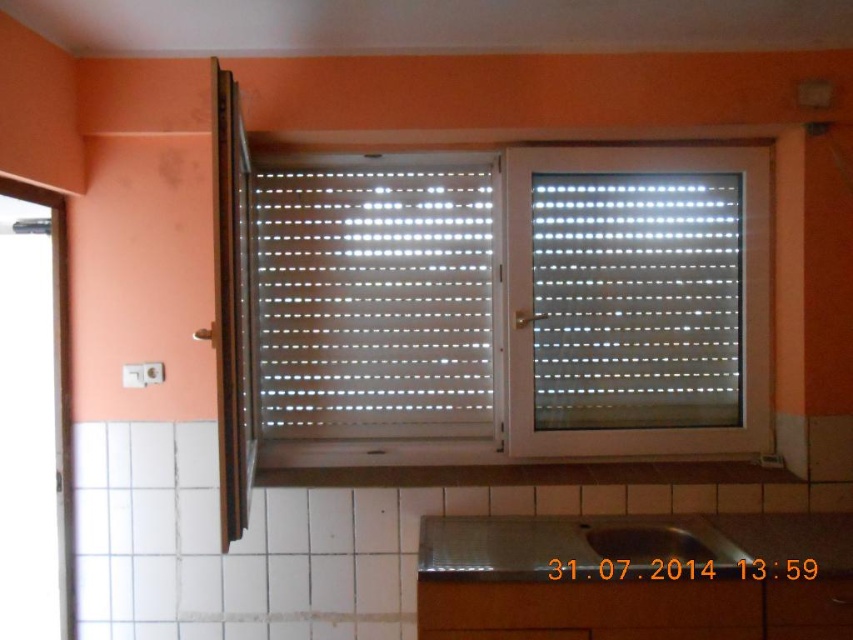
You are an interior designer planning to hang a painting on the wall. The painting has a hook that needs to be placed exactly at the center of the wall. The white plastic blinds at center are currently blocking this spot. Can you move the blinds to the left or right to make space for the hook?

The white plastic blinds at center are positioned at point (636, 300). Since the hook needs to be placed at the exact center of the wall, you can move the blinds either to the left or right to create space for the hook.

You are standing in the room and see two points marked on the wall. The first point is at position point (x=316, y=394) and the second is at point (x=544, y=250). Which point is closer to you?

Point (x=316, y=394) is in front of point (x=544, y=250), so the first point is closer to you.